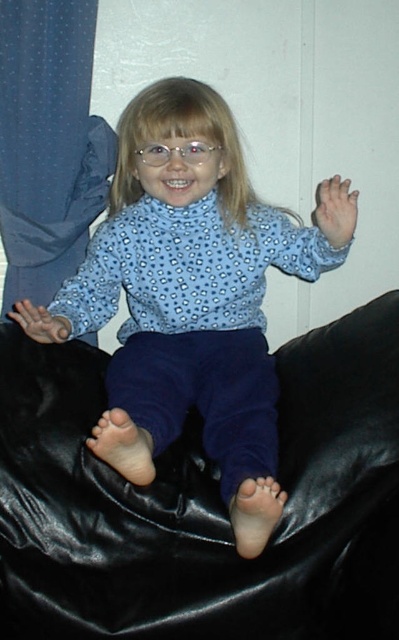
Question: From the image, what is the correct spatial relationship of black leather bean bag chair at center in relation to blue fabric curtain at left?

Choices:
 (A) right
 (B) left

Answer: (A)

Question: Is blue dotted shirt at center above blue fabric curtain at left?

Choices:
 (A) yes
 (B) no

Answer: (B)

Question: Which of the following is the closest to the observer?

Choices:
 (A) 75,556
 (B) 100,236

Answer: (A)

Question: Which of the following is the closest to the observer?

Choices:
 (A) clear plastic glasses at center
 (B) black leather bean bag chair at center
 (C) blue dotted shirt at center

Answer: (C)

Question: Is blue dotted shirt at center positioned in front of clear plastic glasses at center?

Choices:
 (A) no
 (B) yes

Answer: (B)

Question: Which of the following is the closest to the observer?

Choices:
 (A) black leather bean bag chair at center
 (B) blue fabric curtain at left
 (C) blue dotted shirt at center

Answer: (C)